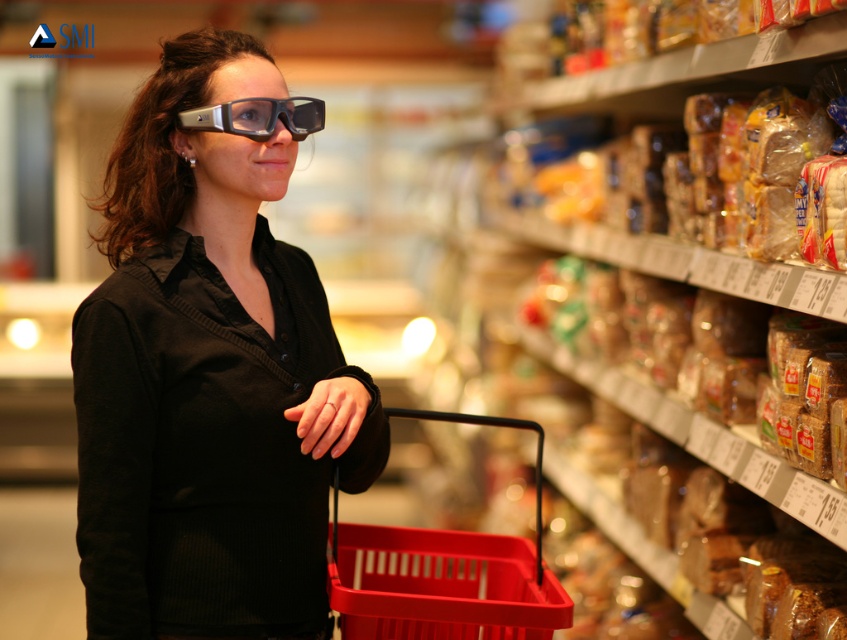
Question: Which object is the closest to the matte plastic basket at lower center?

Choices:
 (A) matte black shirt at center
 (B) translucent plastic bread at upper right
 (C) matte black glasses at center

Answer: (A)

Question: Is matte black shirt at center bigger than matte black glasses at center?

Choices:
 (A) no
 (B) yes

Answer: (B)

Question: Can you confirm if matte plastic basket at lower center is positioned to the left of translucent plastic bread at upper right?

Choices:
 (A) yes
 (B) no

Answer: (A)

Question: Based on their relative distances, which object is nearer to the matte plastic basket at lower center?

Choices:
 (A) matte black glasses at center
 (B) matte black shirt at center
 (C) translucent plastic bread at upper right

Answer: (B)

Question: Which point is farther from the camera taking this photo?

Choices:
 (A) (280, 346)
 (B) (198, 120)
 (C) (757, 147)
 (D) (444, 592)

Answer: (D)

Question: Does matte black shirt at center appear under matte plastic basket at lower center?

Choices:
 (A) no
 (B) yes

Answer: (A)